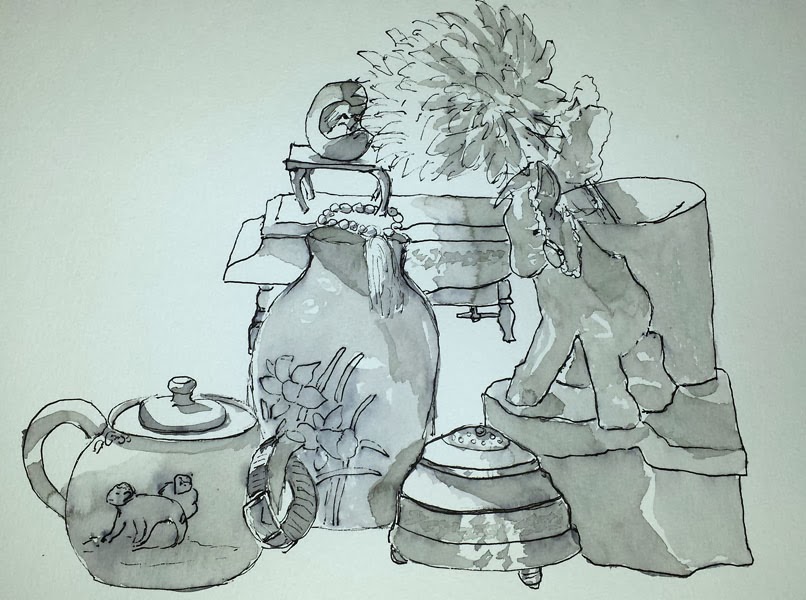
You are a GUI agent. You are given a task and a screenshot of the screen. Output one action in this format:
    pyautogui.click(x=<x>, y=<y>)
    Task: Click on the vase
    The height and width of the screenshot is (600, 806).
    Given the screenshot: What is the action you would take?
    pyautogui.click(x=363, y=360), pyautogui.click(x=667, y=257)